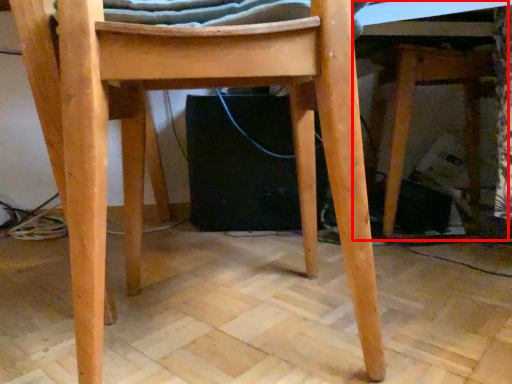
Question: From the image, what is the correct spatial relationship of table (annotated by the red box) in relation to chair?

Choices:
 (A) left
 (B) right

Answer: (B)